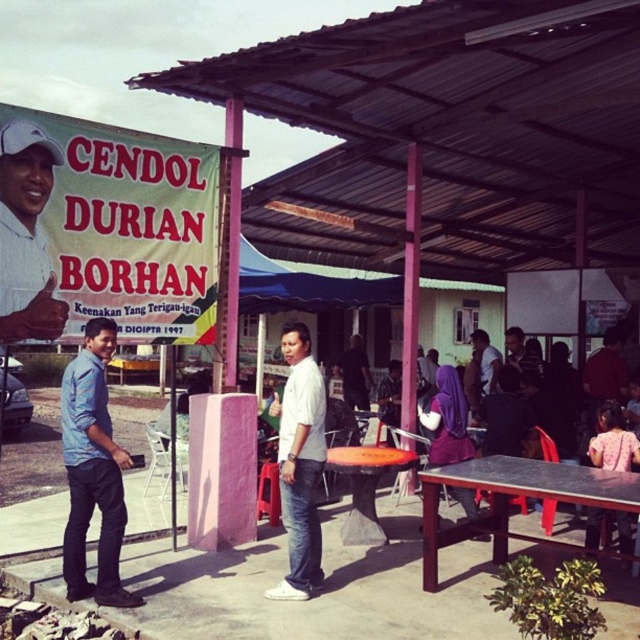
You are a photographer taking a photo of the banner at the food stall. You notice a pink fabric dress at lower right and a matte white shirt at center. To ensure both are in the frame, which direction should you move the camera slightly?

The pink fabric dress at lower right is to the left of matte white shirt at center, so moving the camera slightly to the right would keep both the pink fabric dress at lower right and matte white shirt at center within the frame.

You are a customer standing at the base of the pink metal structure with the banner. You want to hand a menu to the person wearing the matte white shirt at upper left and then to the person wearing the matte white shirt at center. Can you reach both shirts from your current position without moving? Explain your reasoning.

The distance between the matte white shirt at upper left and the matte white shirt at center is 6.43 meters. Since you are at the base of the structure, you cannot reach either shirt without moving closer. The shirts are too far apart for you to reach both from your current position.

You are standing in front of the food stall and notice the matte white shirt at upper left. Can you determine its exact position using the coordinate system provided?

The matte white shirt at upper left is located at point 0.369 along the x axis and 0.042 along the y axis.